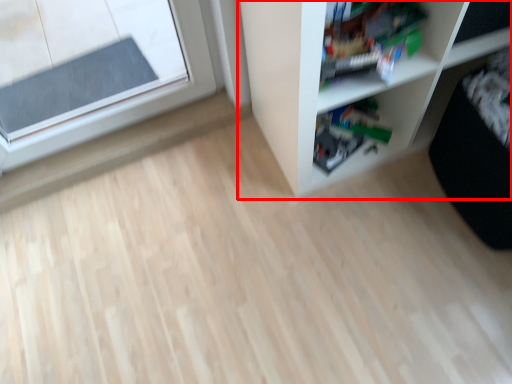
Question: From the image's perspective, considering the relative positions of shelf (annotated by the red box) and toy in the image provided, where is shelf (annotated by the red box) located with respect to the staircase?

Choices:
 (A) above
 (B) below

Answer: (A)